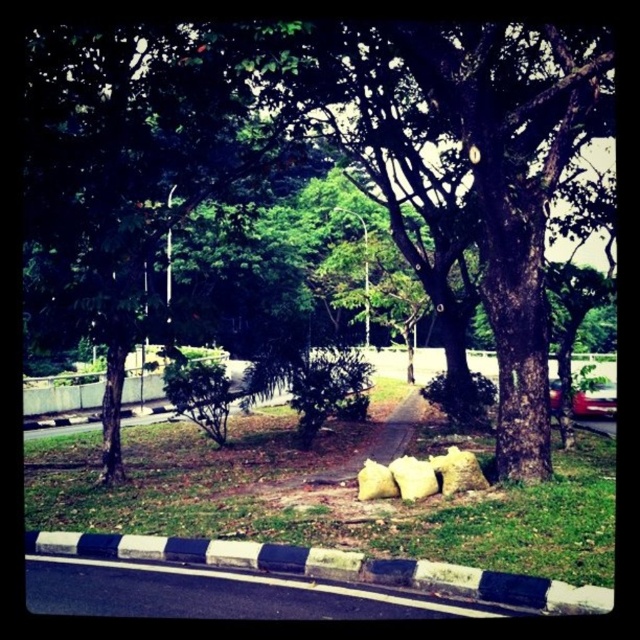
You are a delivery robot positioned at the edge of the green grass at lower center. You need to navigate to the black and white concrete curb at lower center. Is the curb closer to you or further away?

The black and white concrete curb at lower center is further away from you than the green grass at lower center, so the curb is further away.

Looking at this image, you are standing at the point marked as point (342, 152) in the image. What object are you facing?

The point (342, 152) corresponds to the brown rough tree at center, so you are facing the brown rough tree at center.